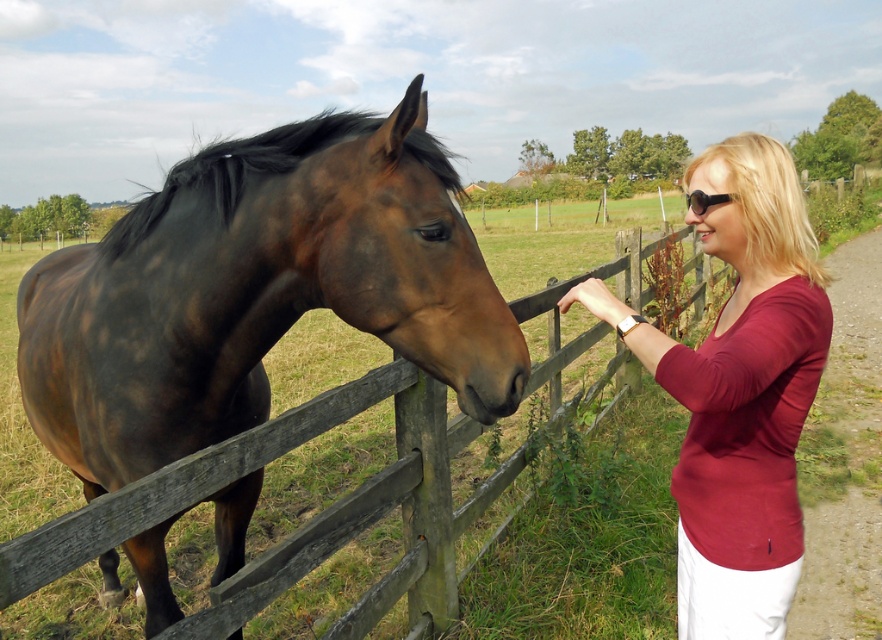
You are a photographer standing 5 feet away from the brown glossy horse at left. You want to take a photo of the horse and the burgundy fabric shirt at right together in the frame. Can you step back to include both in the shot without moving the subjects?

The brown glossy horse at left is 3.76 feet away from the burgundy fabric shirt at right. Since you are currently 5 feet away from the horse, stepping back slightly should allow both subjects to fit in the frame as the distance between them is less than your current distance from the horse.

From the picture: You are a photographer standing in the middle of the grassy field. You want to take a picture of the brown glossy horse at left and the burgundy fabric shirt at right. Which object should you focus on first if you want to capture both in the same frame without moving the camera?

The brown glossy horse at left is taller than the burgundy fabric shirt at right, so you should focus on the brown glossy horse at left first to ensure it fits in the frame.

You are a photographer standing in the middle of the field. You need to take a photo that includes both the brown glossy horse at left and the burgundy fabric shirt at right. Based on their positions, which direction should you move to ensure both are in your frame?

Since the brown glossy horse at left is to the left of the burgundy fabric shirt at right, you should move to the center between them to capture both in your frame.